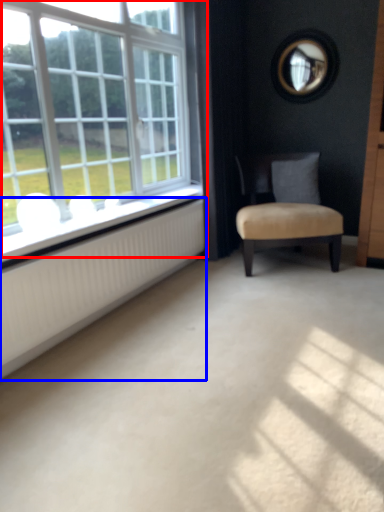
Question: Which object is further to the camera taking this photo, window (highlighted by a red box) or radiator (highlighted by a blue box)?

Choices:
 (A) window
 (B) radiator

Answer: (B)